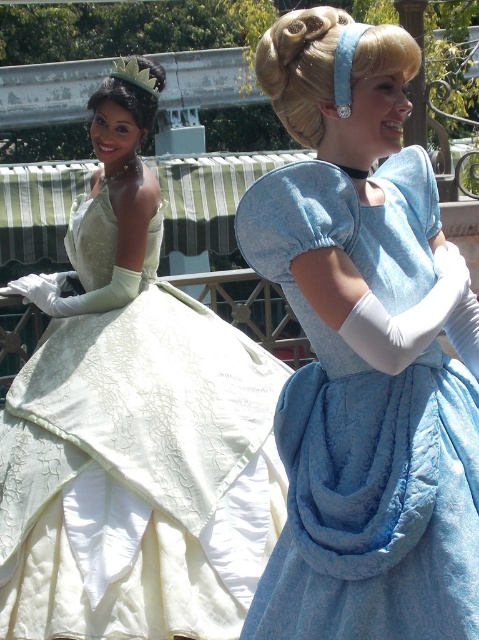
Is point (180, 467) more distant than point (155, 84)?

That is False.

Between matte green gown at center and silver metallic tiara at upper left, which one has more height?

Standing taller between the two is silver metallic tiara at upper left.

The image size is (479, 640). Describe the element at coordinates (133, 429) in the screenshot. I see `matte green gown at center` at that location.

The image size is (479, 640). Identify the location of matte green gown at center. (133, 429).

Locate an element on the screen. The width and height of the screenshot is (479, 640). matte blue dress at center is located at coordinates (364, 352).

Does matte blue dress at center come in front of matte green gown at center?

That is True.

Does point (280, 563) come farther from viewer compared to point (237, 516)?

No, (280, 563) is in front of (237, 516).

Identify the location of matte blue dress at center. The image size is (479, 640). (364, 352).

Does matte blue dress at center have a larger size compared to silver metallic tiara at upper left?

Actually, matte blue dress at center might be smaller than silver metallic tiara at upper left.

Which is above, matte blue dress at center or silver metallic tiara at upper left?

silver metallic tiara at upper left

The height and width of the screenshot is (640, 479). In order to click on matte blue dress at center in this screenshot , I will do pyautogui.click(x=364, y=352).

The height and width of the screenshot is (640, 479). Find the location of `matte blue dress at center`. matte blue dress at center is located at coordinates (364, 352).